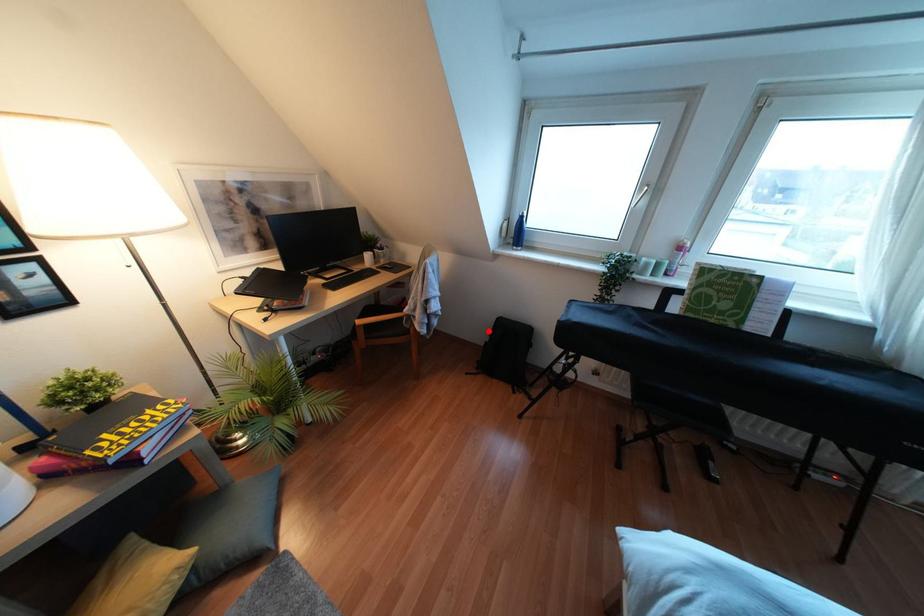
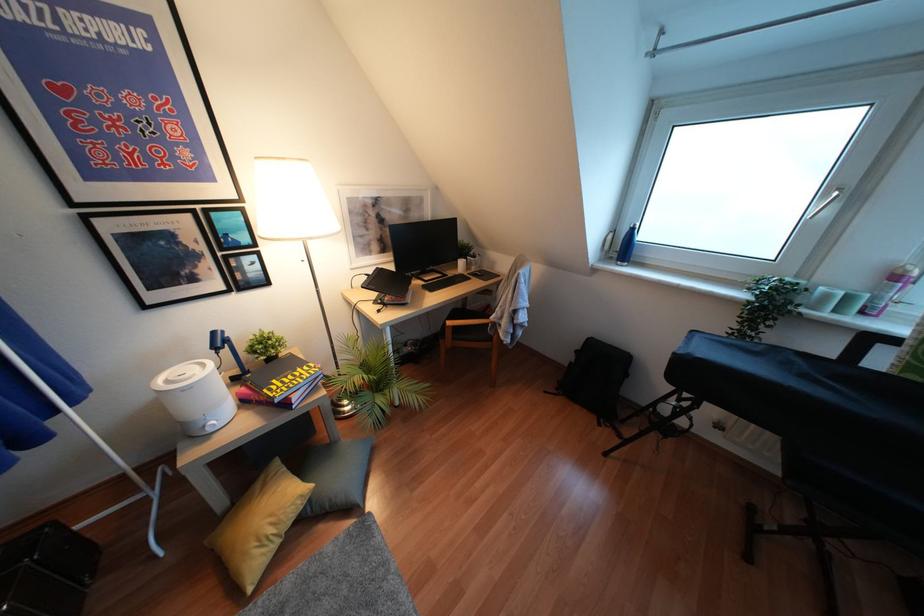
Where in the second image is the point corresponding to the highlighted location from the first image?

(575, 351)